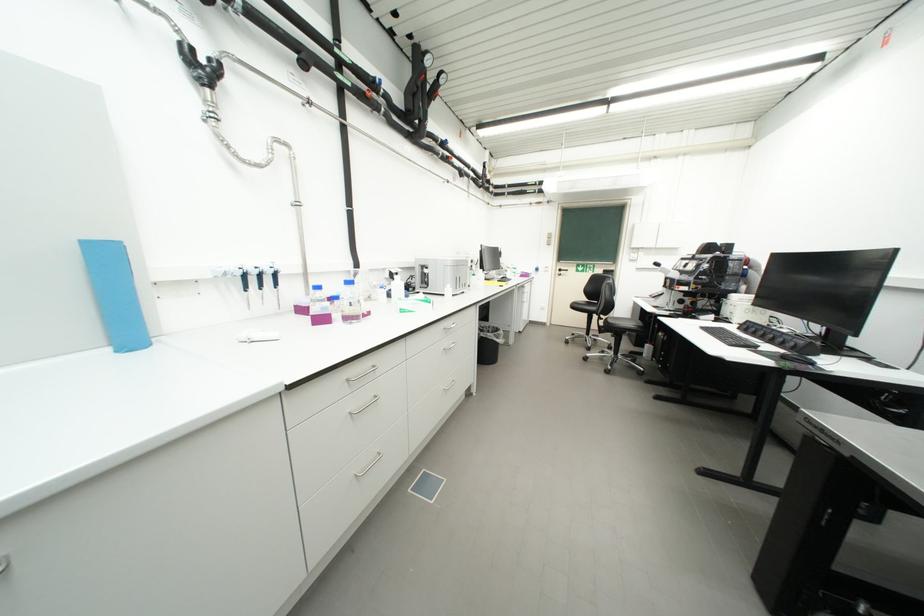
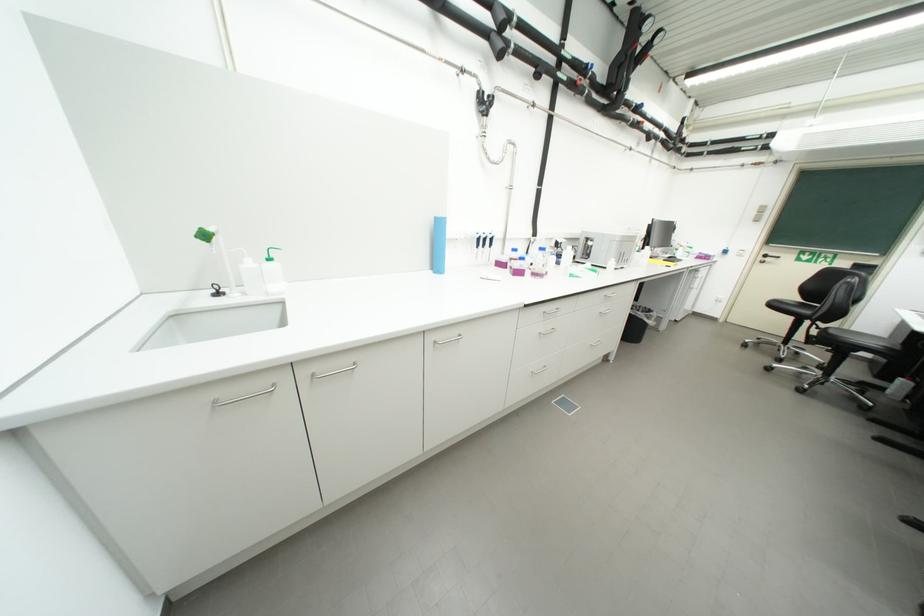
Locate, in the second image, the point that corresponds to point 117,351 in the first image.

(439, 273)